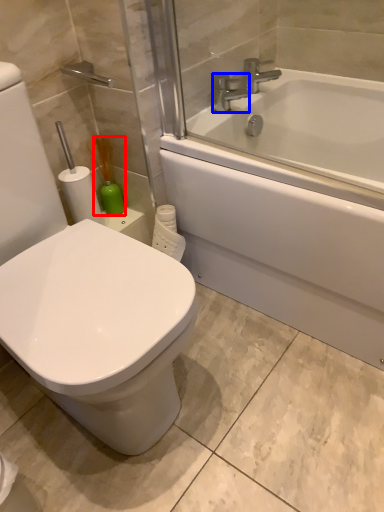
Question: Among these objects, which one is nearest to the camera, soap dispenser (highlighted by a red box) or faucet (highlighted by a blue box)?

Choices:
 (A) soap dispenser
 (B) faucet

Answer: (A)